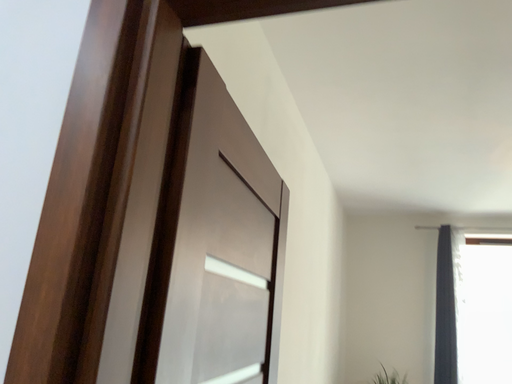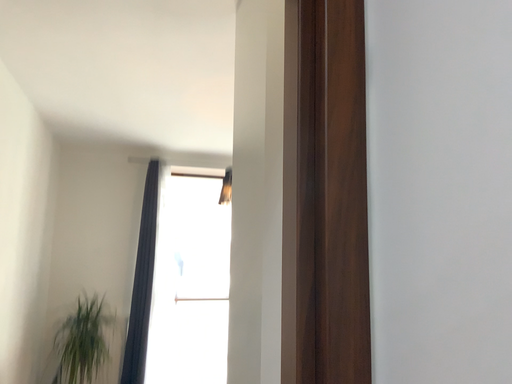
Question: How did the camera likely rotate when shooting the video?

Choices:
 (A) rotated upward
 (B) rotated downward

Answer: (B)